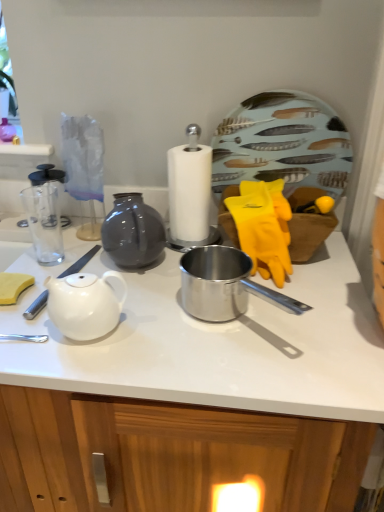
What do you see at coordinates (213, 343) in the screenshot? The height and width of the screenshot is (512, 384). I see `white glossy teapot at center-left` at bounding box center [213, 343].

Locate an element on the screen. This screenshot has width=384, height=512. white glossy teapot at center-left is located at coordinates (213, 343).

Is white glossy teapot at left not close to white glossy teapot at center-left?

No, white glossy teapot at left is not far from white glossy teapot at center-left.

Do you think white glossy teapot at left is within white glossy teapot at center-left, or outside of it?

white glossy teapot at left is contained in white glossy teapot at center-left.

Which of these two, white glossy teapot at left or white glossy teapot at center-left, is wider?

Wider between the two is white glossy teapot at center-left.

Which is more to the left, white glossy teapot at left or white glossy teapot at center-left?

white glossy teapot at left.

From the image's perspective, which one is positioned lower, white glossy teapot at center-left or feather-patterned ceramic plate at upper right?

white glossy teapot at center-left.

Can you confirm if white glossy teapot at center-left is wider than feather-patterned ceramic plate at upper right?

Correct, the width of white glossy teapot at center-left exceeds that of feather-patterned ceramic plate at upper right.

From a real-world perspective, between white glossy teapot at center-left and feather-patterned ceramic plate at upper right, who is vertically higher?

feather-patterned ceramic plate at upper right.

From the picture: In terms of height, does white glossy teapot at center-left look taller or shorter compared to feather-patterned ceramic plate at upper right?

In the image, white glossy teapot at center-left appears to be shorter than feather-patterned ceramic plate at upper right.

The image size is (384, 512). Find the location of `teapot in front of the feather-patterned ceramic plate at upper right`. teapot in front of the feather-patterned ceramic plate at upper right is located at coordinates (84, 304).

Is feather-patterned ceramic plate at upper right facing away from white glossy teapot at left?

No, white glossy teapot at left is not at the back of feather-patterned ceramic plate at upper right.

Based on the photo, who is smaller, feather-patterned ceramic plate at upper right or white glossy teapot at left?

white glossy teapot at left is smaller.

Which object is thinner, feather-patterned ceramic plate at upper right or white glossy teapot at left?

Thinner between the two is feather-patterned ceramic plate at upper right.

Measure the distance between feather-patterned ceramic plate at upper right and white glossy teapot at center-left.

The distance of feather-patterned ceramic plate at upper right from white glossy teapot at center-left is 15.38 inches.

From the image's perspective, who appears lower, feather-patterned ceramic plate at upper right or white glossy teapot at center-left?

white glossy teapot at center-left appears lower in the image.

Which is closer, (306, 148) or (258, 367)?

Point (306, 148) is positioned farther from the camera compared to point (258, 367).

Does point (55, 335) come behind point (82, 280)?

Yes, point (55, 335) is farther from viewer.

Consider the image. From the image's perspective, which one is positioned higher, white glossy teapot at center-left or white glossy teapot at left?

white glossy teapot at center-left appears higher in the image.

Is white glossy teapot at center-left beside white glossy teapot at left?

No, white glossy teapot at center-left is not making contact with white glossy teapot at left.

Would you say white glossy teapot at left is to the left or to the right of feather-patterned ceramic plate at upper right in the picture?

Clearly, white glossy teapot at left is on the left of feather-patterned ceramic plate at upper right in the image.

Is white glossy teapot at left next to feather-patterned ceramic plate at upper right and touching it?

No, white glossy teapot at left is not in contact with feather-patterned ceramic plate at upper right.

Is white glossy teapot at left not inside feather-patterned ceramic plate at upper right?

Absolutely, white glossy teapot at left is external to feather-patterned ceramic plate at upper right.

You are a GUI agent. You are given a task and a screenshot of the screen. Output one action in this format:
    pyautogui.click(x=<x>, y=<y>)
    Task: Click on the teapot lying below the feather-patterned ceramic plate at upper right (from the image's perspective)
    
    Given the screenshot: What is the action you would take?
    pyautogui.click(x=84, y=304)

This screenshot has height=512, width=384. I want to click on countertop that is above the white glossy teapot at left (from the image's perspective), so click(x=213, y=343).

In the image, there is a feather-patterned ceramic plate at upper right. At what (x,y) coordinates should I click in order to perform the action: click on countertop below it (from the image's perspective). Please return your answer as a coordinate pair (x, y). Image resolution: width=384 pixels, height=512 pixels. Looking at the image, I should click on (213, 343).

Looking at the image, which one is located closer to white glossy teapot at left, white glossy teapot at center-left or feather-patterned ceramic plate at upper right?

white glossy teapot at center-left is closer to white glossy teapot at left.

Based on their spatial positions, is white glossy teapot at center-left or white glossy teapot at left further from feather-patterned ceramic plate at upper right?

The object further to feather-patterned ceramic plate at upper right is white glossy teapot at left.

Which object lies nearer to the anchor point white glossy teapot at center-left, feather-patterned ceramic plate at upper right or white glossy teapot at left?

white glossy teapot at left lies closer to white glossy teapot at center-left than the other object.

Which object lies nearer to the anchor point white glossy teapot at left, feather-patterned ceramic plate at upper right or white glossy teapot at center-left?

Among the two, white glossy teapot at center-left is located nearer to white glossy teapot at left.

Based on their spatial positions, is white glossy teapot at left or feather-patterned ceramic plate at upper right closer to white glossy teapot at center-left?

white glossy teapot at left is closer to white glossy teapot at center-left.

When comparing their distances from feather-patterned ceramic plate at upper right, does white glossy teapot at left or white glossy teapot at center-left seem closer?

white glossy teapot at center-left is closer to feather-patterned ceramic plate at upper right.

You are a GUI agent. You are given a task and a screenshot of the screen. Output one action in this format:
    pyautogui.click(x=<x>, y=<y>)
    Task: Click on the countertop located between white glossy teapot at left and feather-patterned ceramic plate at upper right in the left-right direction
    
    Given the screenshot: What is the action you would take?
    pyautogui.click(x=213, y=343)